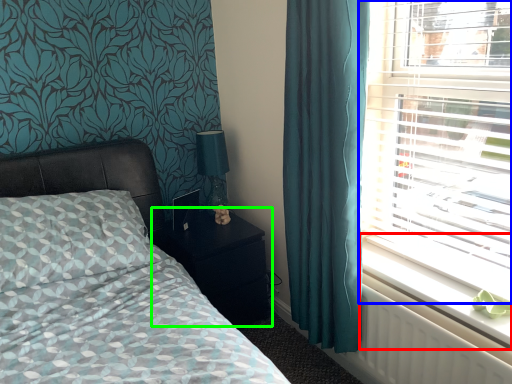
Question: Which object is the closest to the window sill (highlighted by a red box)? Choose among these: window (highlighted by a blue box) or nightstand (highlighted by a green box).

Choices:
 (A) window
 (B) nightstand

Answer: (A)